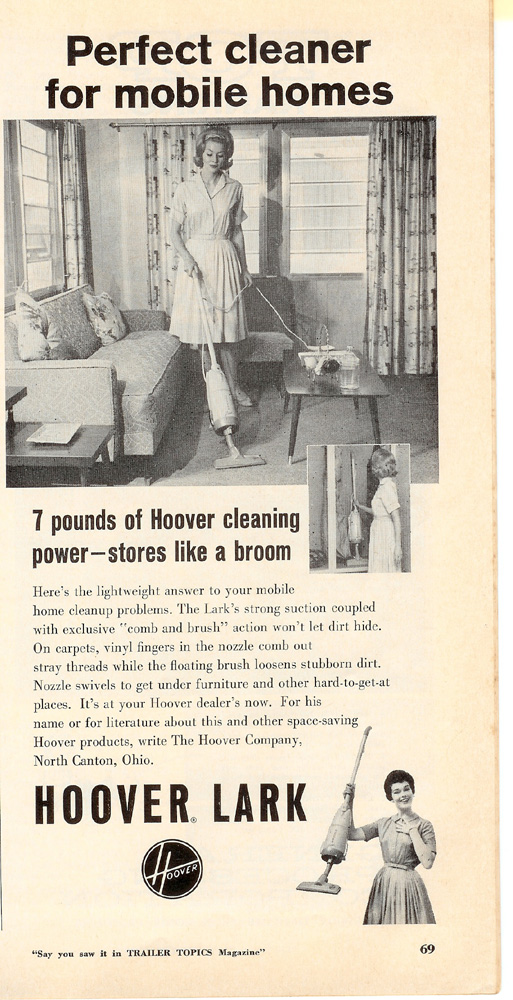
Find the location of a particular element. The image size is (513, 1000). couch seat cushions is located at coordinates (140, 358).